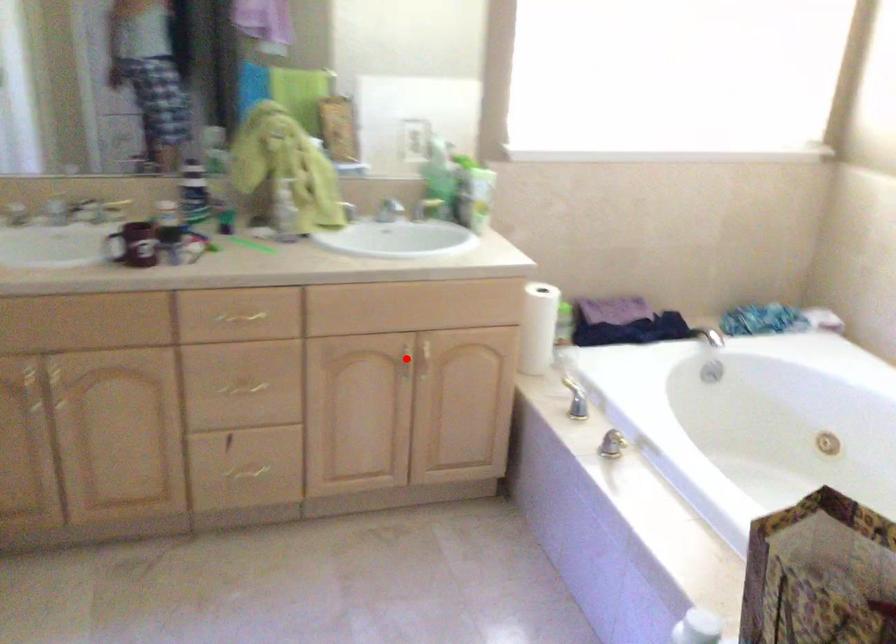
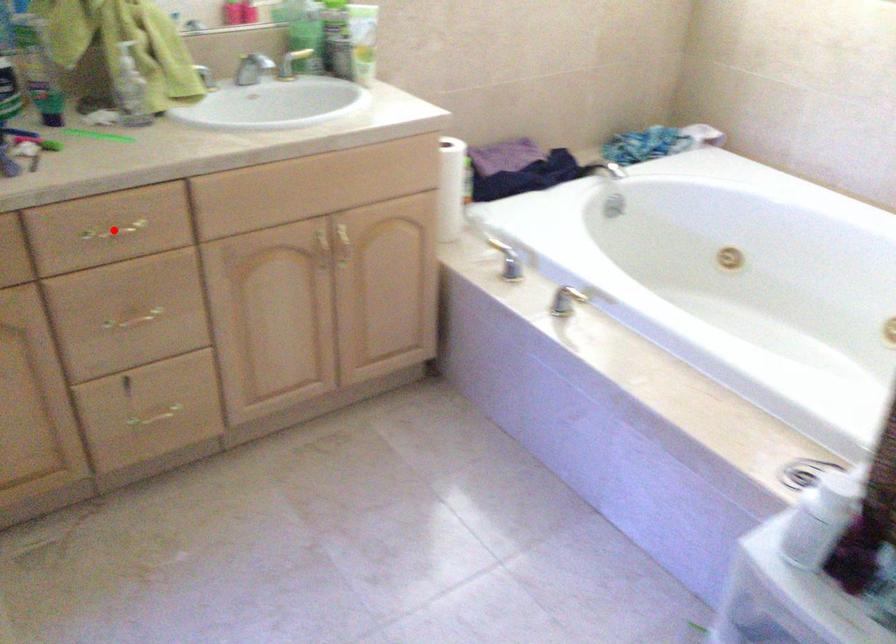
I am providing you with two images of the same scene from different viewpoints. A red point is marked on the first image and another point is marked on the second image. Do the highlighted points in image1 and image2 indicate the same real-world spot?

No